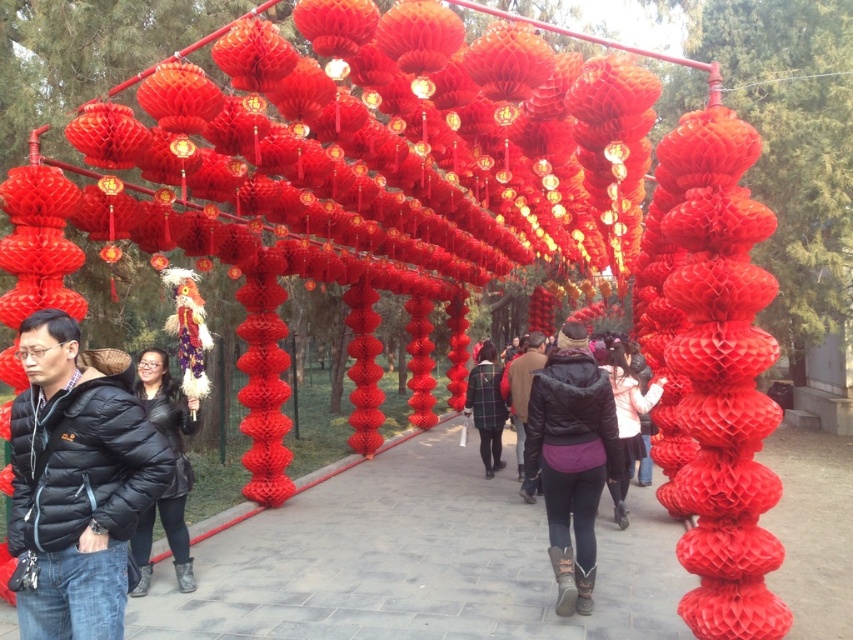
Question: Which object is farther from the camera taking this photo?

Choices:
 (A) purple fleece jacket at center
 (B) plaid shirt at center

Answer: (B)

Question: Which of the following is the closest to the observer?

Choices:
 (A) black puffer jacket at center
 (B) matte red honeycomb at center
 (C) plaid shirt at center
 (D) purple fleece jacket at center

Answer: (D)

Question: Can you confirm if matte red honeycomb at center is thinner than black puffer jacket at center?

Choices:
 (A) no
 (B) yes

Answer: (A)

Question: Does black puffer jacket at center appear on the left side of plaid shirt at center?

Choices:
 (A) yes
 (B) no

Answer: (A)

Question: Which of the following is the farthest from the observer?

Choices:
 (A) (16, 566)
 (B) (469, 384)
 (C) (194, 419)
 (D) (614, 403)

Answer: (B)

Question: Is matte red honeycomb at center bigger than black puffer jacket at center?

Choices:
 (A) no
 (B) yes

Answer: (A)